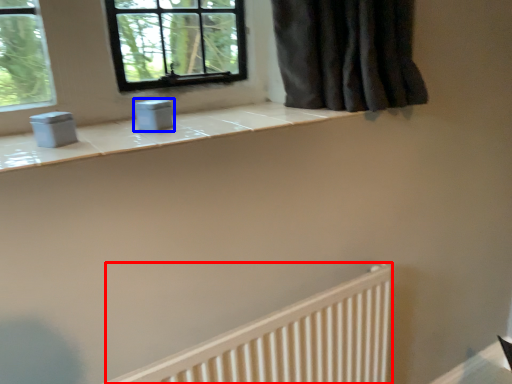
Question: Which of the following is the farthest to the observer, radiator (highlighted by a red box) or gray (highlighted by a blue box)?

Choices:
 (A) radiator
 (B) gray

Answer: (B)